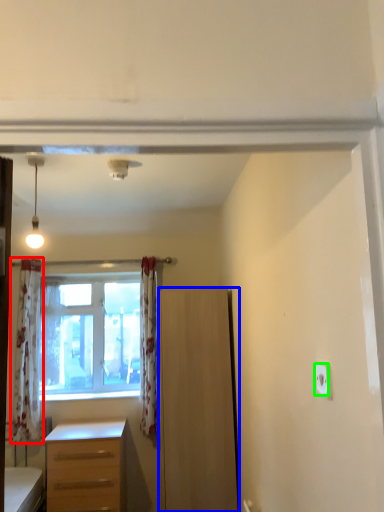
Question: Considering the real-world distances, which object is closest to curtain (highlighted by a red box)? cabinetry (highlighted by a blue box) or electric outlet (highlighted by a green box).

Choices:
 (A) cabinetry
 (B) electric outlet

Answer: (A)